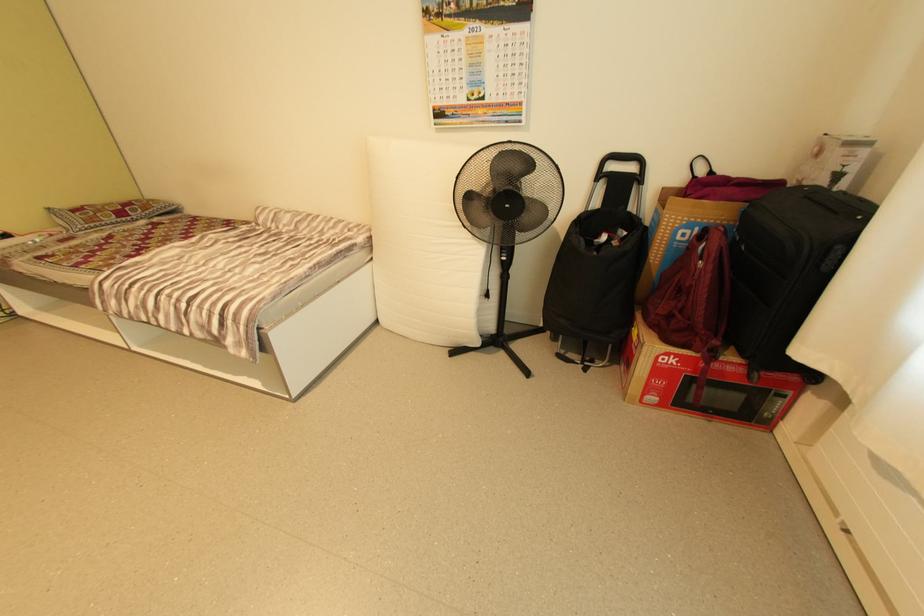
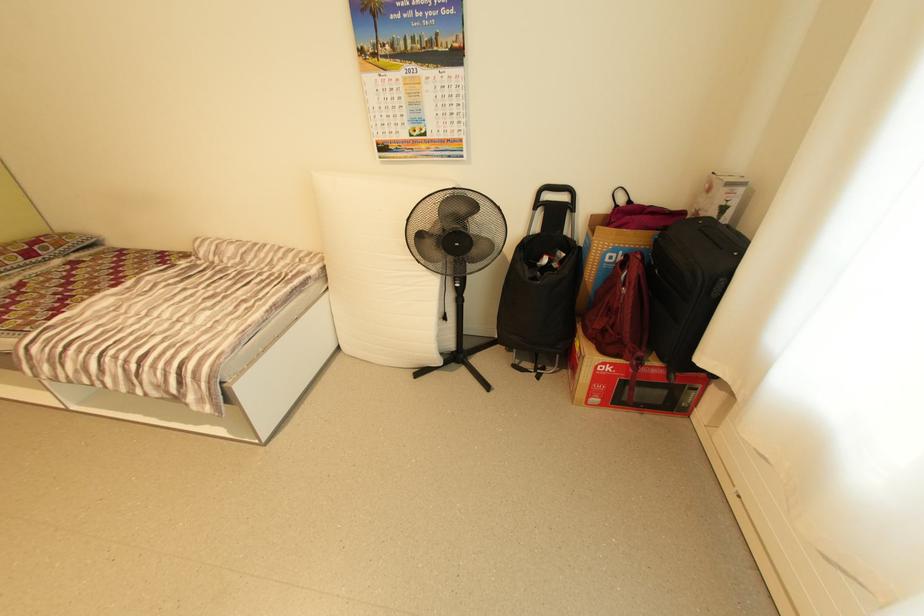
Where in the second image is the point corresponding to the point at 708,172 from the first image?

(628, 201)